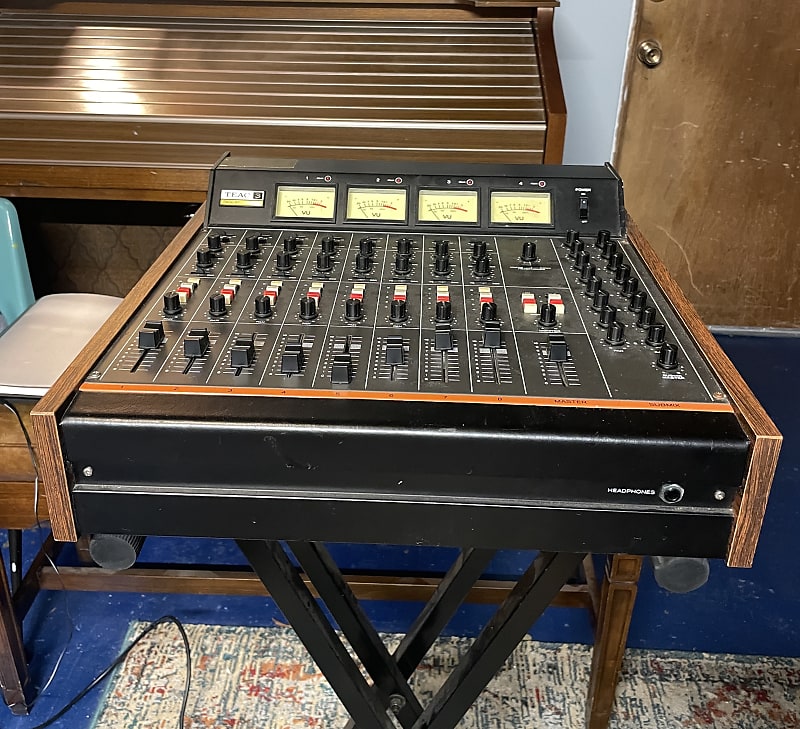
The image size is (800, 729). I want to click on white, red, blue and orange rug, so click(266, 663).